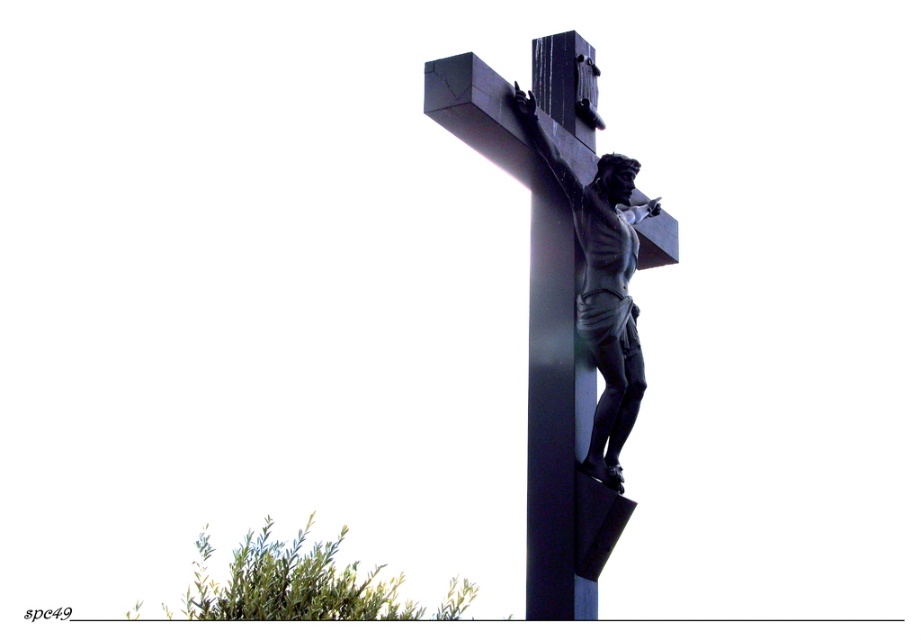
Question: Is black polished cross at center positioned at the back of glossy dark wood pole at center?

Choices:
 (A) no
 (B) yes

Answer: (B)

Question: Among these objects, which one is nearest to the camera?

Choices:
 (A) black polished cross at center
 (B) polished bronze crucifix at center
 (C) glossy dark wood pole at center

Answer: (C)

Question: Among these points, which one is farthest from the camera?

Choices:
 (A) (570, 310)
 (B) (585, 189)
 (C) (597, 122)

Answer: (C)

Question: Among these points, which one is nearest to the camera?

Choices:
 (A) (546, 61)
 (B) (475, 106)

Answer: (B)

Question: Does black polished cross at center appear on the right side of polished bronze crucifix at center?

Choices:
 (A) no
 (B) yes

Answer: (A)

Question: Can you confirm if glossy dark wood pole at center is bigger than polished bronze crucifix at center?

Choices:
 (A) no
 (B) yes

Answer: (B)